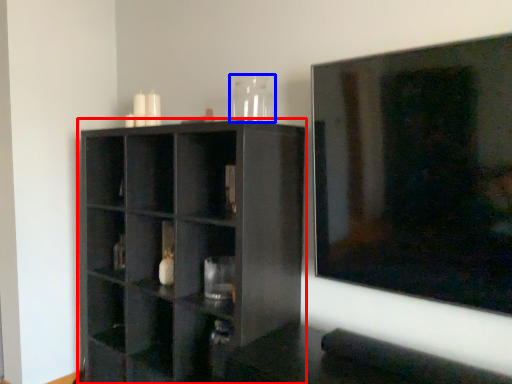
Question: Among these objects, which one is farthest to the camera, shelf (highlighted by a red box) or glass vase (highlighted by a blue box)?

Choices:
 (A) shelf
 (B) glass vase

Answer: (B)